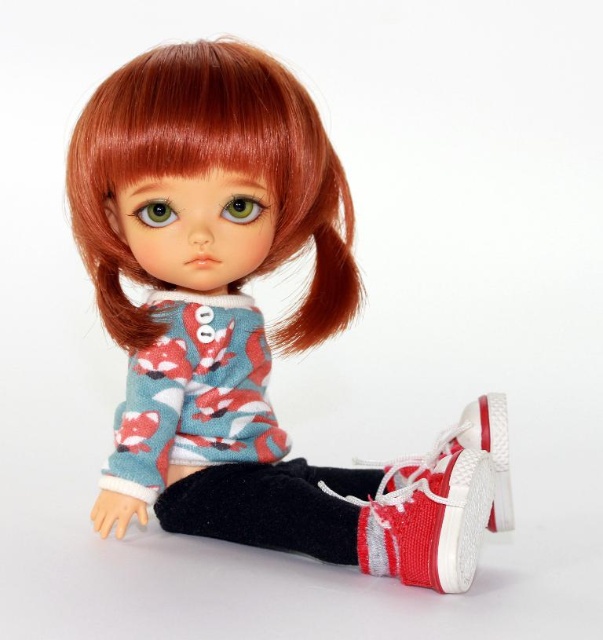
Can you confirm if matte fabric doll at center is bigger than shiny orange hair at upper center?

Indeed, matte fabric doll at center has a larger size compared to shiny orange hair at upper center.

Who is taller, matte fabric doll at center or shiny orange hair at upper center?

matte fabric doll at center is taller.

The image size is (603, 640). What do you see at coordinates (247, 323) in the screenshot?
I see `matte fabric doll at center` at bounding box center [247, 323].

You are a GUI agent. You are given a task and a screenshot of the screen. Output one action in this format:
    pyautogui.click(x=<x>, y=<y>)
    Task: Click on the matte fabric doll at center
    The height and width of the screenshot is (640, 603).
    Given the screenshot: What is the action you would take?
    pyautogui.click(x=247, y=323)

Between matte fabric doll at center and teal fox-patterned sweater at center, which one has more height?

matte fabric doll at center is taller.

The height and width of the screenshot is (640, 603). What do you see at coordinates (247, 323) in the screenshot?
I see `matte fabric doll at center` at bounding box center [247, 323].

Is point (244, 310) in front of point (188, 448)?

No, (244, 310) is further to viewer.

The width and height of the screenshot is (603, 640). Identify the location of matte fabric doll at center. (247, 323).

Does teal fox-patterned sweater at center have a smaller size compared to velvet black sock at lower center?

Actually, teal fox-patterned sweater at center might be larger than velvet black sock at lower center.

Who is more distant from viewer, (153,474) or (312,483)?

The point (312,483) is more distant.

Which is behind, point (172, 314) or point (203, 522)?

Positioned behind is point (172, 314).

At what (x,y) coordinates should I click in order to perform the action: click on teal fox-patterned sweater at center. Please return your answer as a coordinate pair (x, y). Looking at the image, I should click on (194, 394).